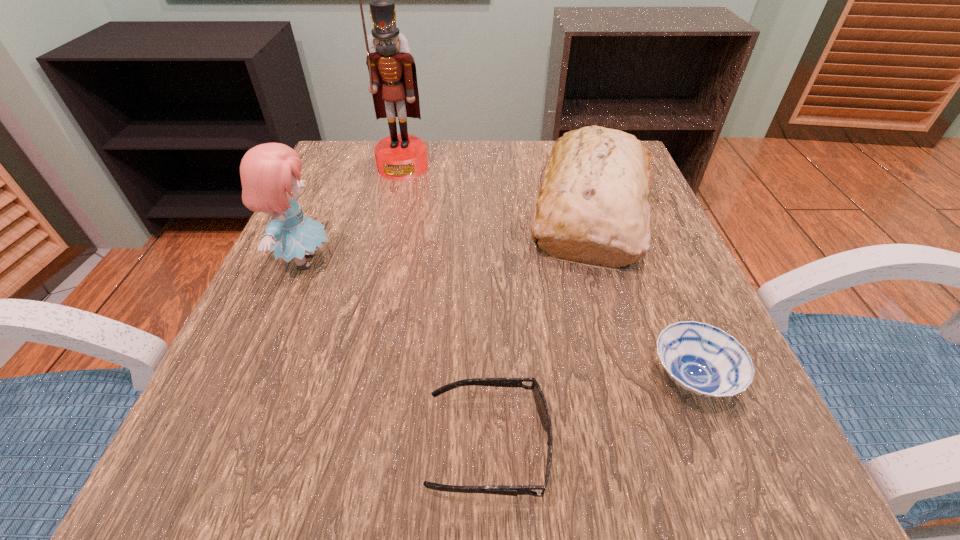
Locate an element on the screen. The height and width of the screenshot is (540, 960). soup bowl positioned at the right edge is located at coordinates (704, 360).

Locate an element on the screen. Image resolution: width=960 pixels, height=540 pixels. object at the far left corner is located at coordinates (393, 79).

Locate an element on the screen. object located at the far right corner is located at coordinates (593, 206).

The image size is (960, 540). I want to click on vacant space at the far edge of the desktop, so click(x=490, y=183).

Locate an element on the screen. free space at the left edge of the desktop is located at coordinates (307, 287).

Find the location of a particular element. free space at the right edge of the desktop is located at coordinates (646, 256).

This screenshot has height=540, width=960. In order to click on vacant position at the far left corner of the desktop in this screenshot , I will do `click(348, 165)`.

The image size is (960, 540). In order to click on free space between the soup bowl and the nutcracker in this screenshot , I will do `click(547, 273)`.

The height and width of the screenshot is (540, 960). What are the coordinates of `free area in between the sunglasses and the fourth shortest object` in the screenshot? It's located at (396, 353).

Where is `vacant region between the nutcracker and the soup bowl`? This screenshot has height=540, width=960. vacant region between the nutcracker and the soup bowl is located at coordinates (547, 273).